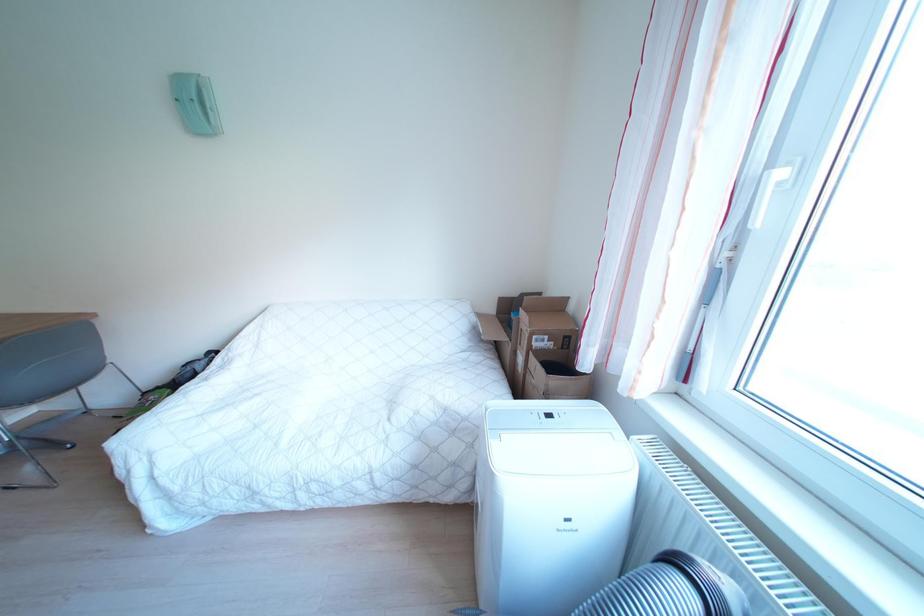
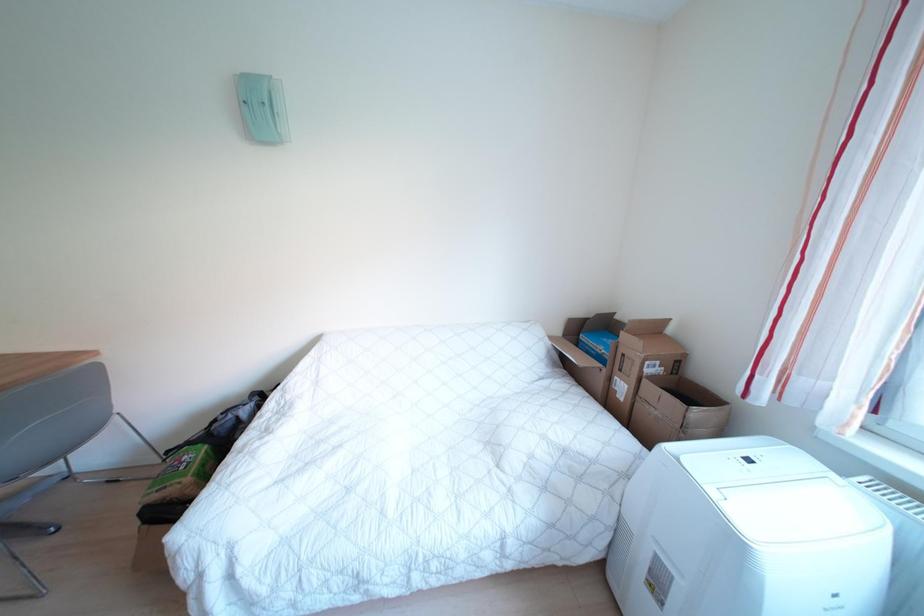
Question: What movement of the cameraman would produce the second image?

Choices:
 (A) Left
 (B) Right
 (C) Forward
 (D) Backward

Answer: (A)